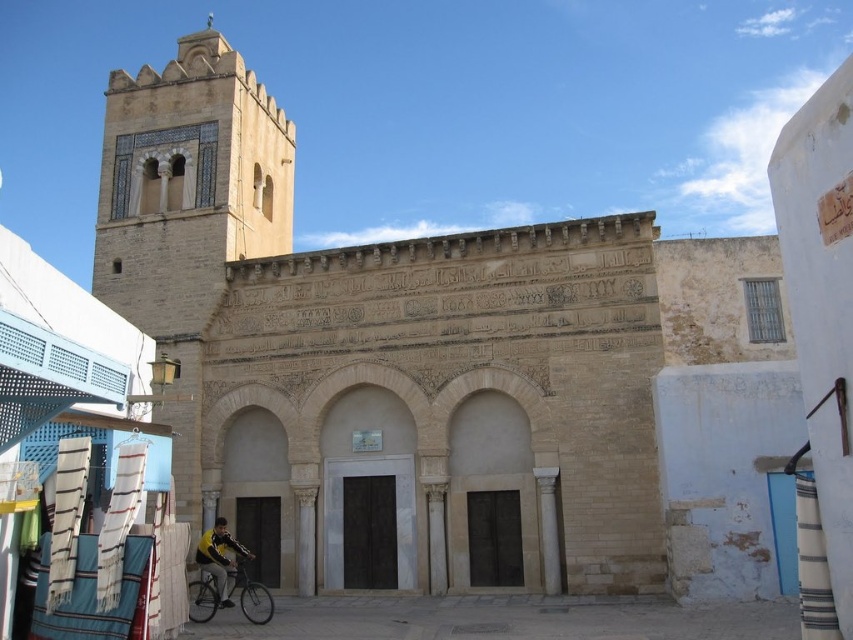
Consider the image. You are a tourist standing in front of the historical building and notice both the silver metallic bicycle at lower left and the yellow fabric jacket at lower left. Which object is bigger in size?

The silver metallic bicycle at lower left is larger in size compared to the yellow fabric jacket at lower left.

You are an architect planning to place a yellow fabric jacket at lower left next to the beige stone church at center. Considering their sizes, which object will occupy more space horizontally?

The beige stone church at center has a larger width than the yellow fabric jacket at lower left, so it will occupy more horizontal space.

You are a delivery person standing at the entrance of the historical building. You need to place a package on the silver metallic bicycle at lower left, but you are currently holding the yellow fabric jacket at lower left. Can you reach the bicycle without moving the jacket?

The silver metallic bicycle at lower left is 2.69 meters away from the yellow fabric jacket at lower left. Since the distance is more than arm length, you cannot reach the bicycle without moving the jacket.